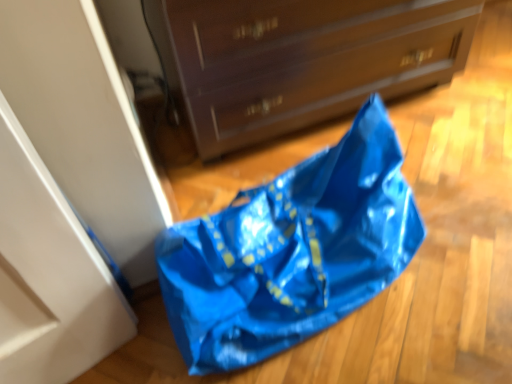
Locate an element on the screen. This screenshot has height=384, width=512. vacant space that is in between matte brown chest of drawers at center and blue plastic bag at lower center is located at coordinates (397, 144).